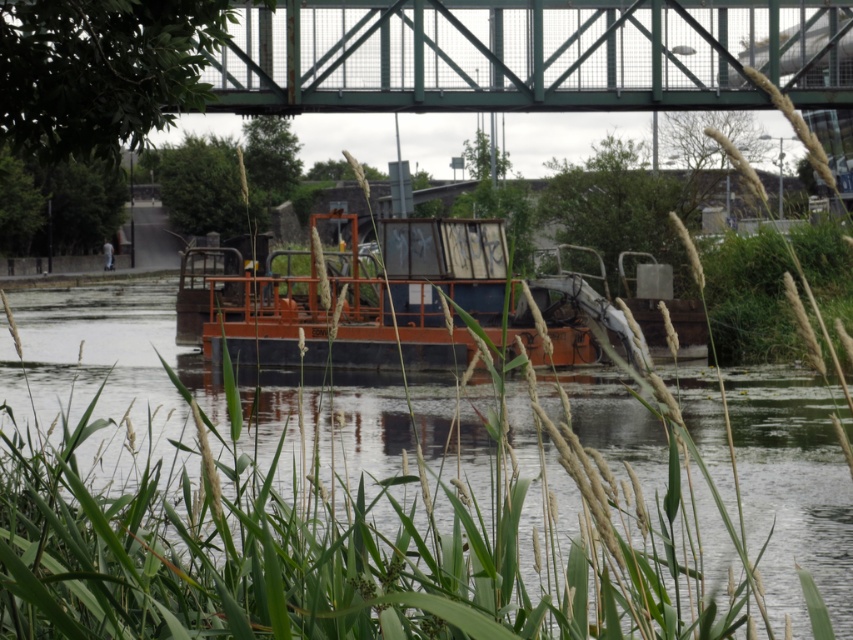
Does rusty metal barge at center appear over green metal bridge at upper center?

No, rusty metal barge at center is not above green metal bridge at upper center.

Is point (229, 604) positioned behind point (619, 3)?

No, it is in front of (619, 3).

Who is more distant from viewer, (625, 390) or (491, 76)?

The point (625, 390) is behind.

This screenshot has height=640, width=853. Identify the location of rusty metal barge at center. pyautogui.click(x=392, y=499).